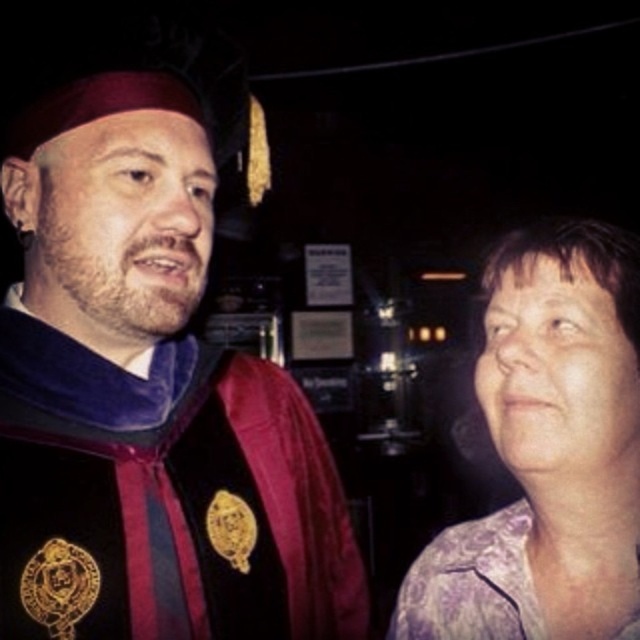
You are a photographer at an event and need to ensure both the purple textured blouse at right and the purple satin blouse at right are visible in your photo. Given their sizes, which blouse should you focus on to ensure both are fully captured in the frame?

The purple textured blouse at right is bigger than the purple satin blouse at right, so focusing on the larger one ensures both can be seen in the frame.